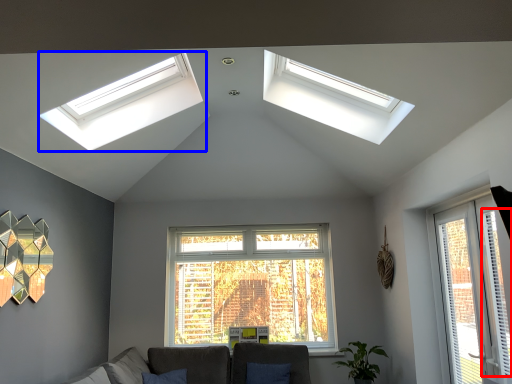
Question: Which object appears closest to the camera in this image, curtain (highlighted by a red box) or window (highlighted by a blue box)?

Choices:
 (A) curtain
 (B) window

Answer: (A)